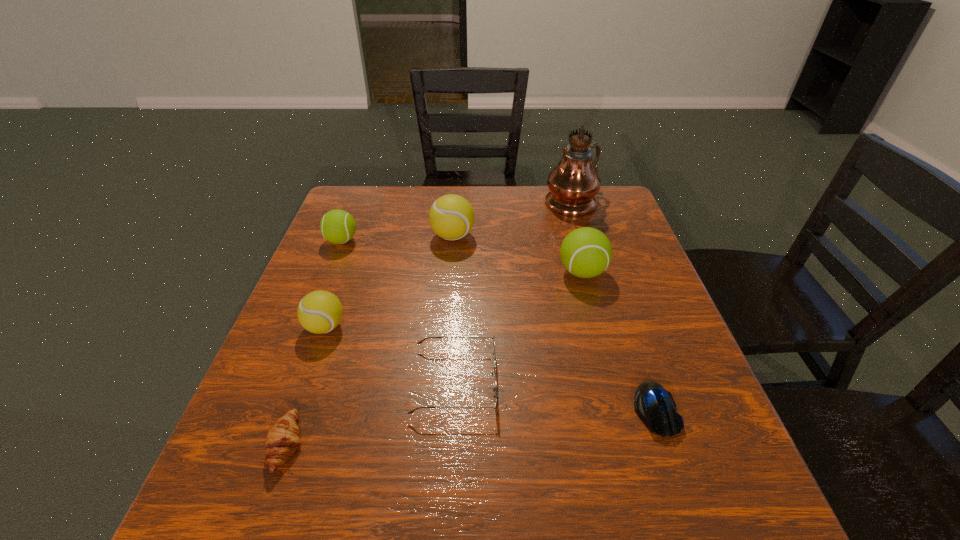
At what (x,y) coordinates should I click in order to perform the action: click on object located in the far right corner section of the desktop. Please return your answer as a coordinate pair (x, y). The image size is (960, 540). Looking at the image, I should click on (573, 184).

This screenshot has height=540, width=960. Find the location of `free region at the far edge of the desktop`. free region at the far edge of the desktop is located at coordinates (518, 219).

Identify the location of free space at the near edge of the desktop. The width and height of the screenshot is (960, 540). pos(549,487).

Locate an element on the screen. This screenshot has height=540, width=960. vacant area at the left edge is located at coordinates [x=324, y=366].

Find the location of a particular element. This screenshot has width=960, height=540. vacant space at the right edge is located at coordinates click(x=709, y=432).

Locate an element on the screen. This screenshot has width=960, height=540. vacant space at the far right corner of the desktop is located at coordinates (605, 192).

Identify the location of free space between the farther green tennis ball and the smaller yellow tennis ball. (333, 284).

This screenshot has width=960, height=540. In order to click on vacant space that is in between the second shortest object and the left yellow tennis ball in this screenshot , I will do `click(306, 386)`.

Locate an element on the screen. vacant region between the bigger yellow tennis ball and the left green tennis ball is located at coordinates (397, 238).

Locate an element on the screen. empty space that is in between the farthest object and the fourth nearest object is located at coordinates (448, 264).